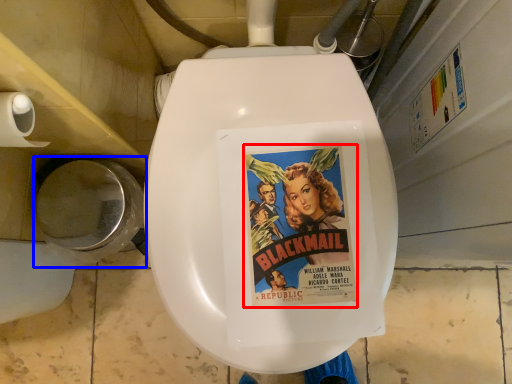
Question: Among these objects, which one is farthest to the camera, movie poster (highlighted by a red box) or toilet bowl (highlighted by a blue box)?

Choices:
 (A) movie poster
 (B) toilet bowl

Answer: (B)